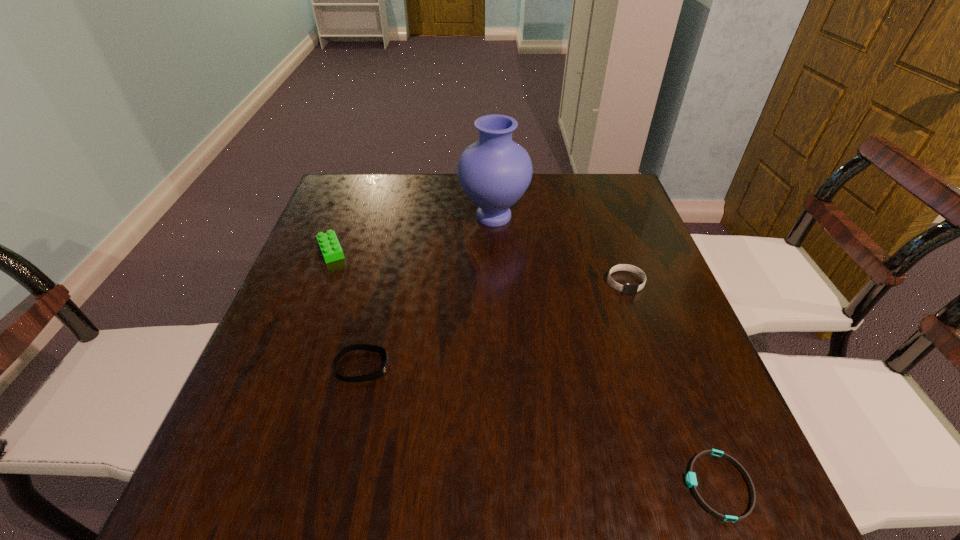
You are a GUI agent. You are given a task and a screenshot of the screen. Output one action in this format:
    pyautogui.click(x=<x>, y=<y>)
    Task: Click on the free space located on the back of the Lego
    The image size is (960, 540).
    Given the screenshot: What is the action you would take?
    (343, 220)

Locate an element on the screen. The width and height of the screenshot is (960, 540). free space located 0.120m on the outer surface of the tallest wristband is located at coordinates (643, 334).

You are a GUI agent. You are given a task and a screenshot of the screen. Output one action in this format:
    pyautogui.click(x=<x>, y=<y>)
    Task: Click on the free point located 0.070m on the display of the second nearest object
    Image resolution: width=960 pixels, height=540 pixels.
    Given the screenshot: What is the action you would take?
    pyautogui.click(x=424, y=366)

Locate an element on the screen. The image size is (960, 540). free region located 0.230m on the buckle of the shortest object is located at coordinates (544, 485).

Locate an element on the screen. free space located on the buckle of the shortest object is located at coordinates (539, 485).

Find the location of a particular element. free space located on the buckle of the shortest object is located at coordinates (643, 485).

Image resolution: width=960 pixels, height=540 pixels. Find the location of `object present at the far edge`. object present at the far edge is located at coordinates (494, 172).

Where is `object positioned at the near edge`? object positioned at the near edge is located at coordinates (691, 481).

This screenshot has height=540, width=960. What are the coordinates of `object that is at the left edge` in the screenshot? It's located at (330, 247).

Identify the location of object situated at the near right corner. (691, 481).